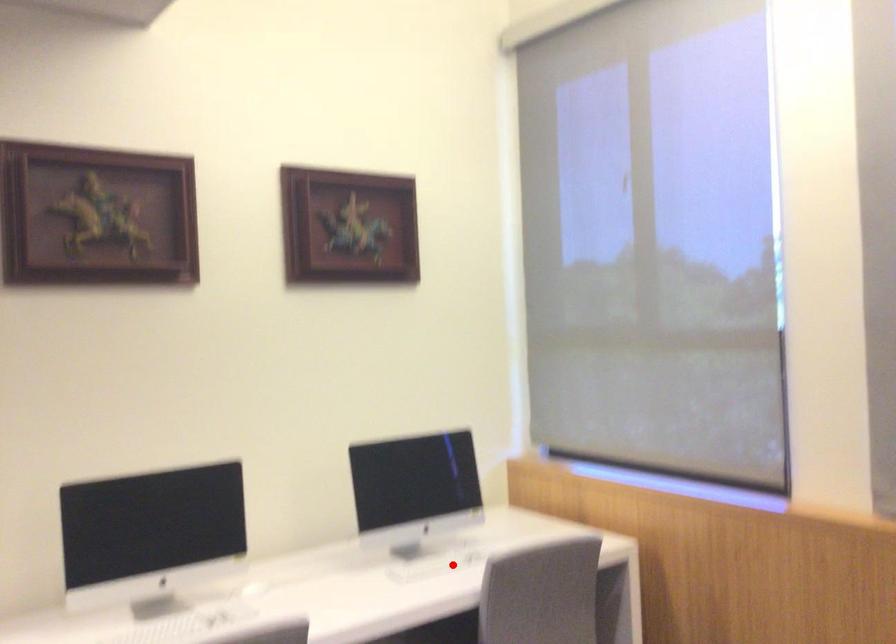
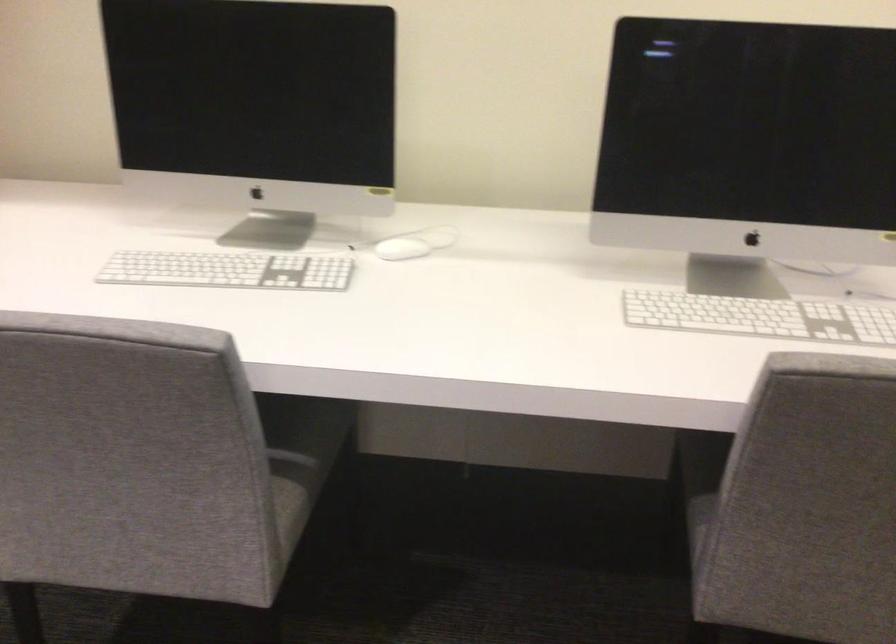
Question: I am providing you with two images of the same scene from different viewpoints. A red point is shown in image1. For the corresponding object point in image2, is it positioned nearer or farther from the camera?

Choices:
 (A) Nearer
 (B) Farther

Answer: (A)